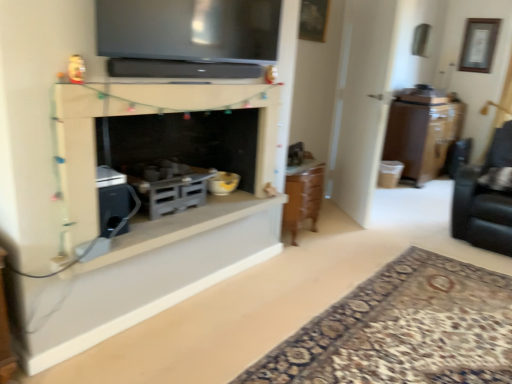
Find the location of a particular element. vacant space to the left of black leather swivel chair at right is located at coordinates (412, 226).